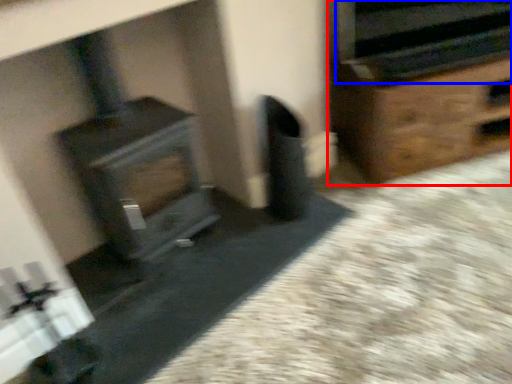
Question: Which of the following is the closest to the observer, furniture (highlighted by a red box) or stereo (highlighted by a blue box)?

Choices:
 (A) furniture
 (B) stereo

Answer: (B)